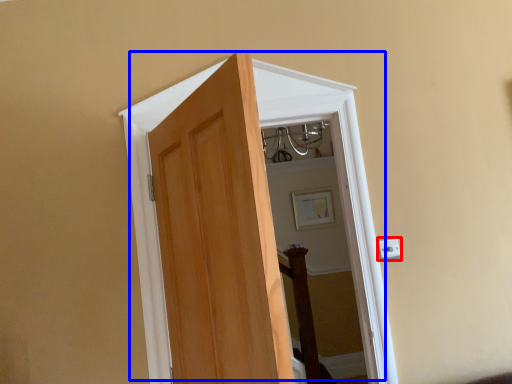
Question: Which object appears closest to the camera in this image, electric outlet (highlighted by a red box) or door (highlighted by a blue box)?

Choices:
 (A) electric outlet
 (B) door

Answer: (B)